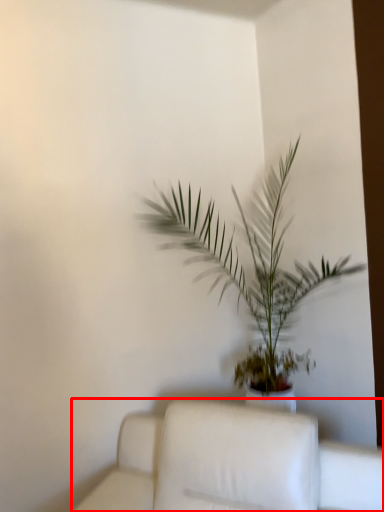
Question: Observing the image, what is the correct spatial positioning of furniture (annotated by the red box) in reference to houseplant?

Choices:
 (A) right
 (B) left

Answer: (B)